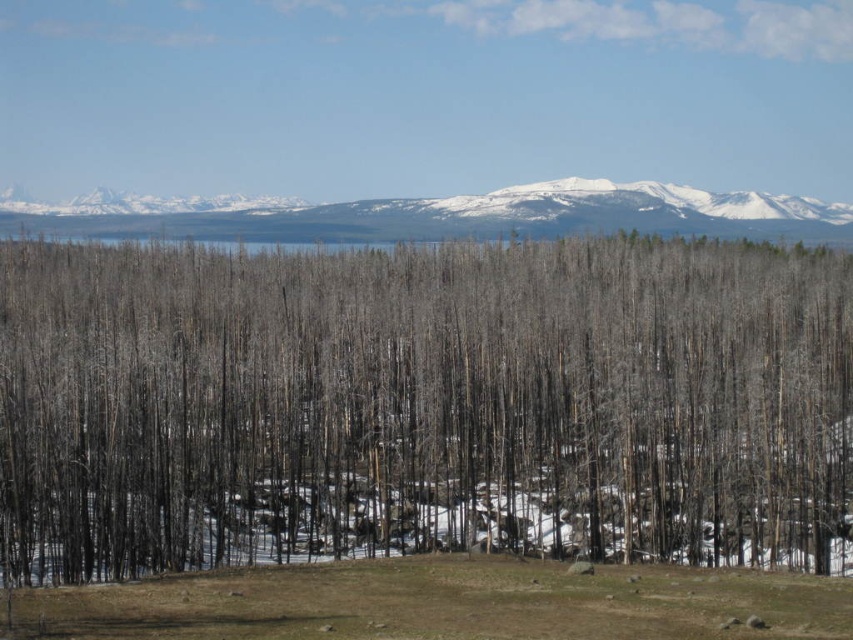
You are standing at the origin point of the coordinate system in the image. You want to walk towards the charred wood trees at center. Which direction should you move in terms of the coordinate system?

The charred wood trees at center are located at coordinate point (422, 404), so you should move towards the direction of increasing x and y coordinates to reach them.

You are a hiker planning to cross from the charred wood trees at center to the snowy granite mountain range at upper center. Based on the distance between them, can you safely make the journey in one hour if your average walking speed is 5 km per hour?

The distance between the charred wood trees at center and the snowy granite mountain range at upper center is 45.13 meters. At an average walking speed of 5 km per hour, you can cover 45.13 meters in about 0.009 minutes, which is roughly 0.54 seconds. Therefore, you can safely make the journey in one hour.

You are a hiker planning a route through this landscape. You need to decide whether to walk towards the charred wood trees at center or the snowy granite mountain range at upper center first. Which direction should you choose if you want to reach the closer object first?

You should walk towards the charred wood trees at center first because they are closer to the viewer than the snowy granite mountain range at upper center.